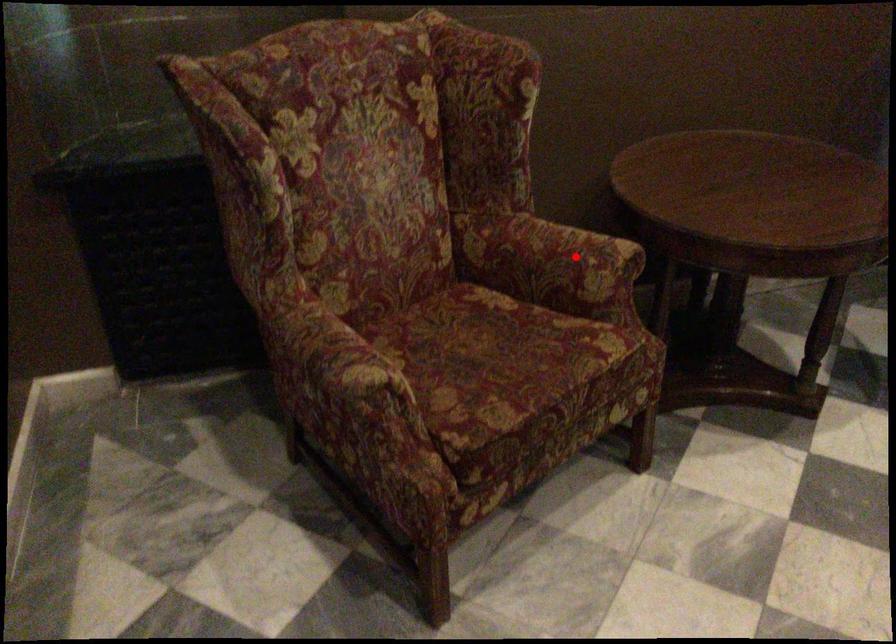
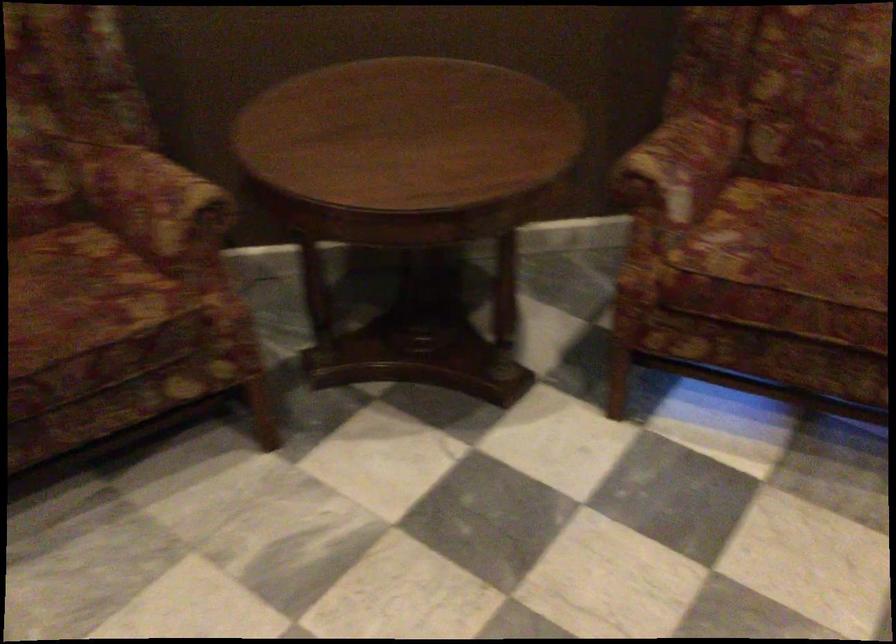
In the second image, find the point that corresponds to the highlighted location in the first image.

(156, 204)